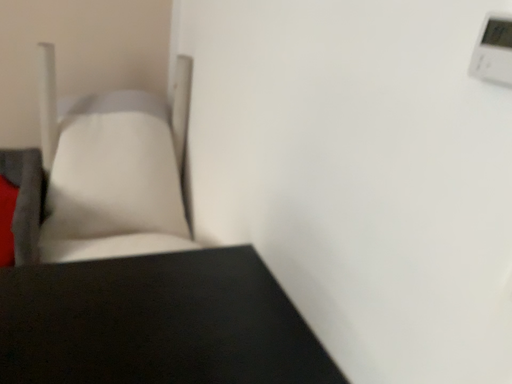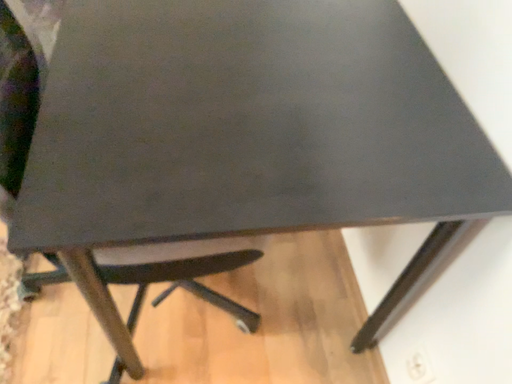
Question: How did the camera likely rotate when shooting the video?

Choices:
 (A) rotated upward
 (B) rotated downward

Answer: (B)